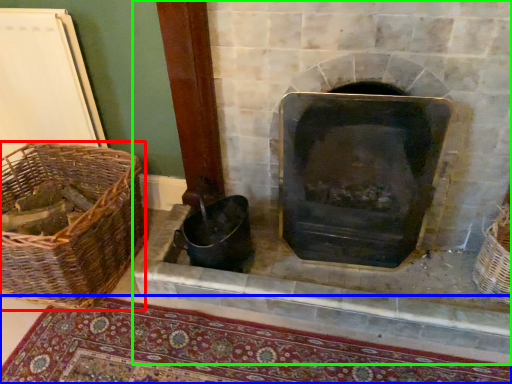
Question: Which object is the farthest from basket (highlighted by a red box)? Choose among these: mat (highlighted by a blue box) or fireplace (highlighted by a green box).

Choices:
 (A) mat
 (B) fireplace

Answer: (B)